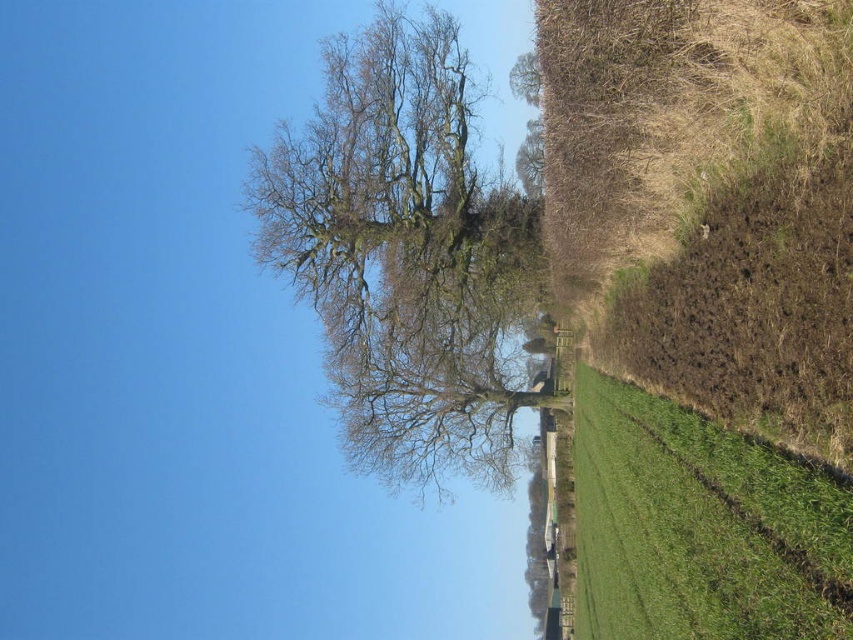
Question: Is bare branches tree at center positioned before green grassy field at right?

Choices:
 (A) yes
 (B) no

Answer: (B)

Question: Is bare branches tree at center to the left of green grassy field at right from the viewer's perspective?

Choices:
 (A) no
 (B) yes

Answer: (B)

Question: Does bare branches tree at center appear on the right side of green grassy field at right?

Choices:
 (A) no
 (B) yes

Answer: (A)

Question: Which point is closer to the camera?

Choices:
 (A) bare branches tree at center
 (B) green grassy field at right

Answer: (B)

Question: Among these points, which one is farthest from the camera?

Choices:
 (A) (378, 177)
 (B) (735, 536)

Answer: (A)

Question: Which point is closer to the camera?

Choices:
 (A) (618, 490)
 (B) (403, 161)

Answer: (A)